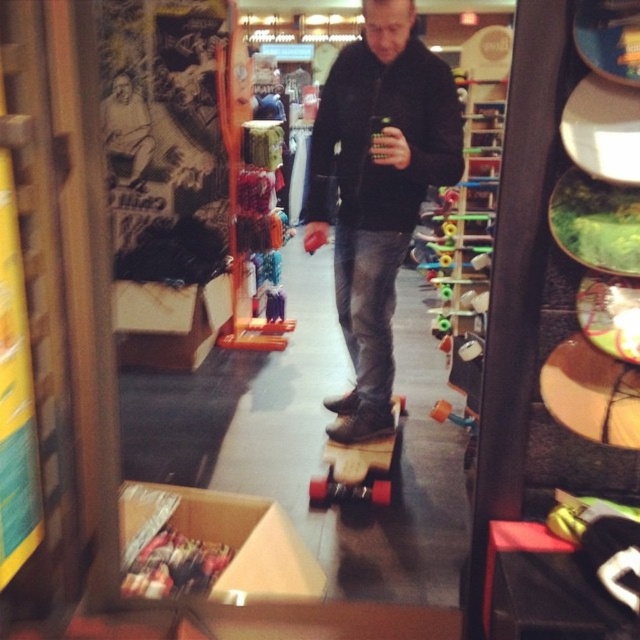
Does black leather jacket at center have a larger size compared to wooden deck skateboard at center?

Yes.

This screenshot has width=640, height=640. In order to click on black leather jacket at center in this screenshot , I will do `click(376, 131)`.

Where is `black leather jacket at center`? black leather jacket at center is located at coordinates (376, 131).

Does wooden skateboard at center have a larger size compared to wooden deck skateboard at center?

Yes.

Who is higher up, wooden skateboard at center or wooden deck skateboard at center?

wooden skateboard at center is above.

Between point (358, 168) and point (332, 481), which one is positioned behind?

The point (332, 481) is behind.

Identify the location of wooden skateboard at center. The image size is (640, 640). (378, 189).

Is point (378, 67) closer to viewer compared to point (436, 124)?

No.

Is point (336, 406) positioned before point (364, 129)?

That is False.

The height and width of the screenshot is (640, 640). I want to click on wooden skateboard at center, so click(378, 189).